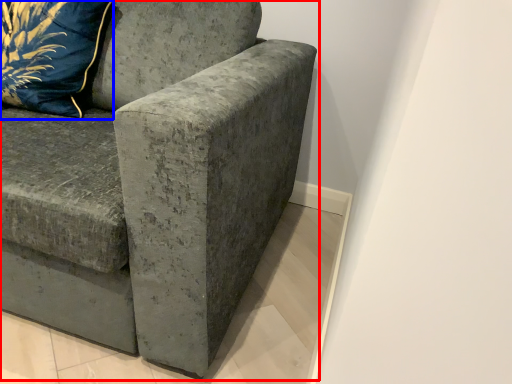
Question: Which object is further to the camera taking this photo, studio couch (highlighted by a red box) or pillow (highlighted by a blue box)?

Choices:
 (A) studio couch
 (B) pillow

Answer: (B)